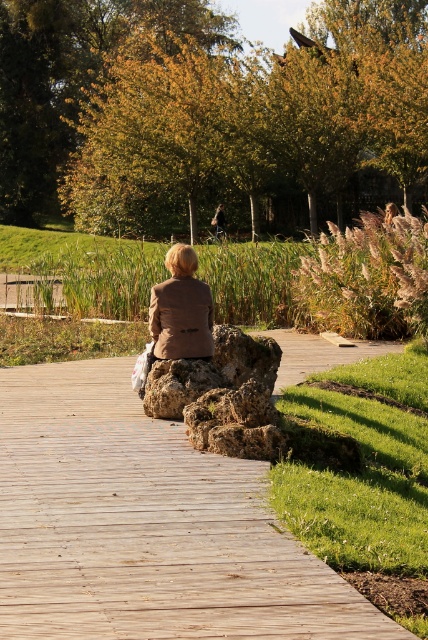
Question: Estimate the real-world distances between objects in this image. Which object is closer to the dark brown leather jacket at center?

Choices:
 (A) brown leather jacket at center
 (B) wooden at center

Answer: (A)

Question: Is wooden at center below brown leather jacket at center?

Choices:
 (A) yes
 (B) no

Answer: (A)

Question: Is brown leather jacket at center thinner than dark brown leather jacket at center?

Choices:
 (A) no
 (B) yes

Answer: (A)

Question: Which of the following is the farthest from the observer?

Choices:
 (A) dark brown leather jacket at center
 (B) brown leather jacket at center

Answer: (A)

Question: Which point is farther to the camera?

Choices:
 (A) wooden at center
 (B) brown leather jacket at center

Answer: (B)

Question: From the image, what is the correct spatial relationship of wooden at center in relation to brown leather jacket at center?

Choices:
 (A) left
 (B) right

Answer: (B)